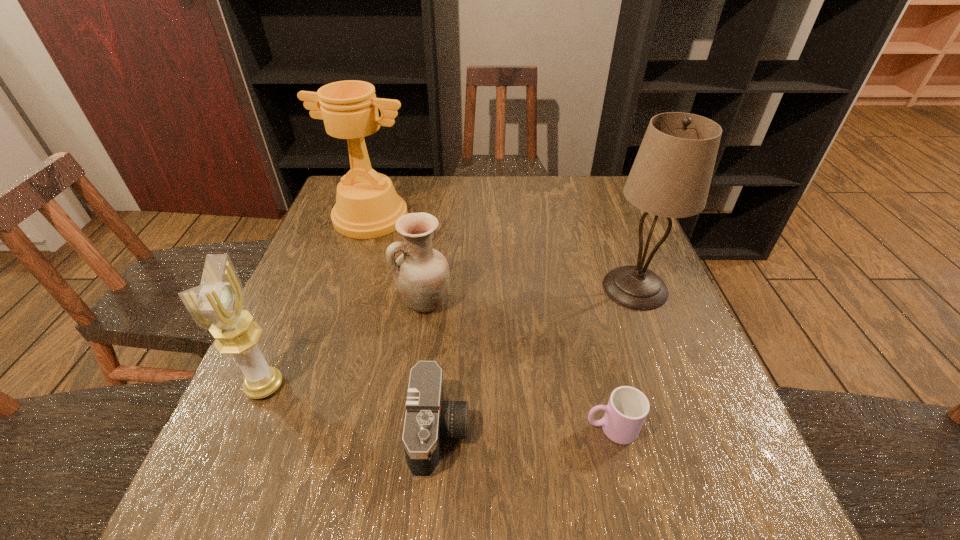
Locate an element on the screen. This screenshot has width=960, height=540. object located at the far left corner is located at coordinates (367, 206).

I want to click on free space at the far edge, so click(415, 183).

Find the location of a particular element. blank space at the near edge of the desktop is located at coordinates (394, 521).

You are a GUI agent. You are given a task and a screenshot of the screen. Output one action in this format:
    pyautogui.click(x=<x>, y=<y>)
    Task: Click on the free spot at the left edge of the desktop
    The image size is (960, 540).
    Given the screenshot: What is the action you would take?
    pyautogui.click(x=288, y=316)

In the image, there is a desktop. Where is `vacant space at the right edge`? The height and width of the screenshot is (540, 960). vacant space at the right edge is located at coordinates (698, 409).

In the image, there is a desktop. At what (x,y) coordinates should I click in order to perform the action: click on vacant area at the far right corner. Please return your answer as a coordinate pair (x, y). The width and height of the screenshot is (960, 540). Looking at the image, I should click on (600, 193).

Where is `free region at the near right corner`? Image resolution: width=960 pixels, height=540 pixels. free region at the near right corner is located at coordinates (747, 478).

You are a GUI agent. You are given a task and a screenshot of the screen. Output one action in this format:
    pyautogui.click(x=<x>, y=<y>)
    Task: Click on the free spot between the farthest object and the shortest object
    
    Given the screenshot: What is the action you would take?
    pyautogui.click(x=491, y=322)

Where is `vacant region between the lampshade and the third shortest object`? Image resolution: width=960 pixels, height=540 pixels. vacant region between the lampshade and the third shortest object is located at coordinates (530, 295).

Where is `blank region between the shorter award and the pottery`? This screenshot has height=540, width=960. blank region between the shorter award and the pottery is located at coordinates (345, 344).